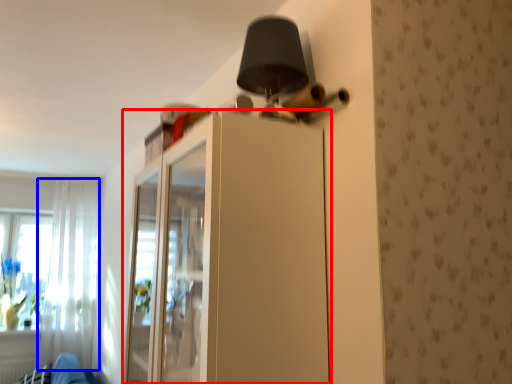
Question: Which object is closer to the camera taking this photo, dresser (highlighted by a red box) or curtain (highlighted by a blue box)?

Choices:
 (A) dresser
 (B) curtain

Answer: (A)